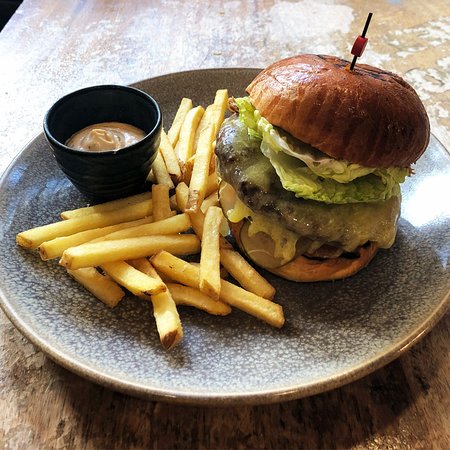
Identify the location of black pot. (143, 160).